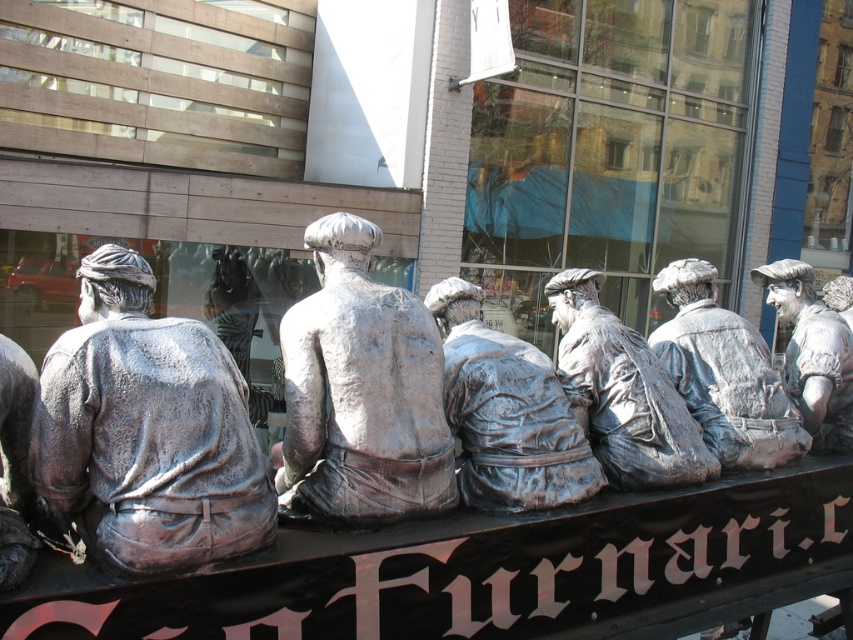
Does bronze statue at center have a smaller size compared to silver textured statue at center?

Yes.

Locate an element on the screen. The height and width of the screenshot is (640, 853). bronze statue at center is located at coordinates (361, 392).

Does point (396, 406) come behind point (642, 452)?

No, (396, 406) is in front of (642, 452).

I want to click on bronze statue at center, so click(x=361, y=392).

Can you confirm if shiny silver statue at left is thinner than silver textured statue at center?

In fact, shiny silver statue at left might be wider than silver textured statue at center.

Does shiny silver statue at left appear over silver textured statue at center?

Yes.

Which is behind, point (190, 355) or point (647, 376)?

Point (647, 376)

Identify the location of shiny silver statue at left. Image resolution: width=853 pixels, height=640 pixels. (146, 432).

Which is above, silver textured statue at center or polished silver statue at right?

polished silver statue at right is higher up.

Is silver textured statue at center above polished silver statue at right?

No, silver textured statue at center is not above polished silver statue at right.

The height and width of the screenshot is (640, 853). What do you see at coordinates (622, 392) in the screenshot?
I see `silver textured statue at center` at bounding box center [622, 392].

Where is `silver textured statue at center`? This screenshot has height=640, width=853. silver textured statue at center is located at coordinates (622, 392).